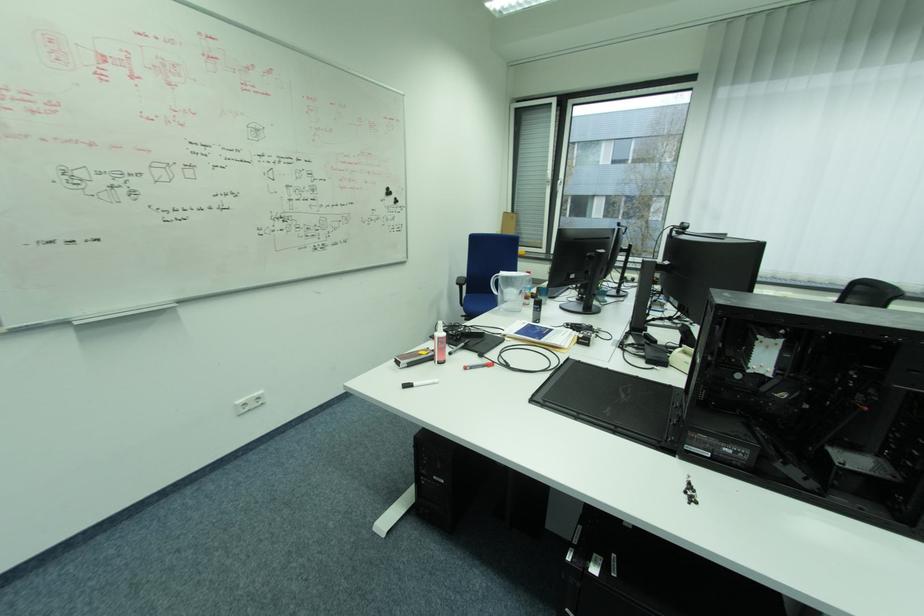
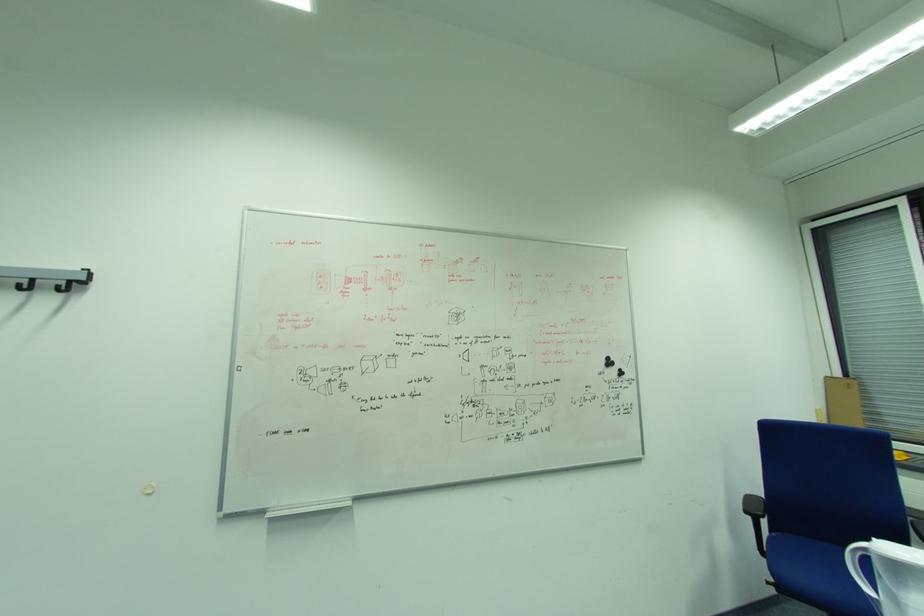
Find the pixel in the second image that matches (x=466, y=286) in the first image.

(757, 517)